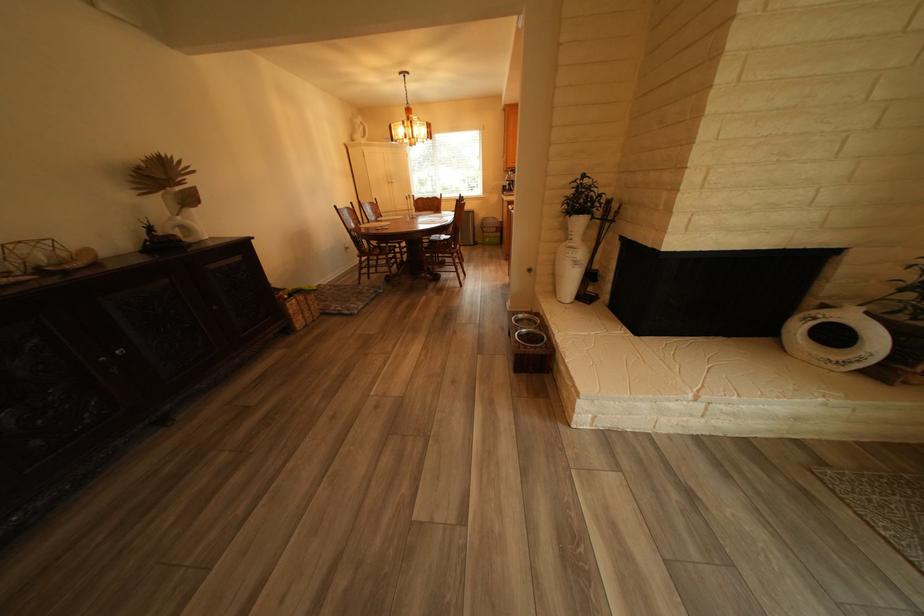
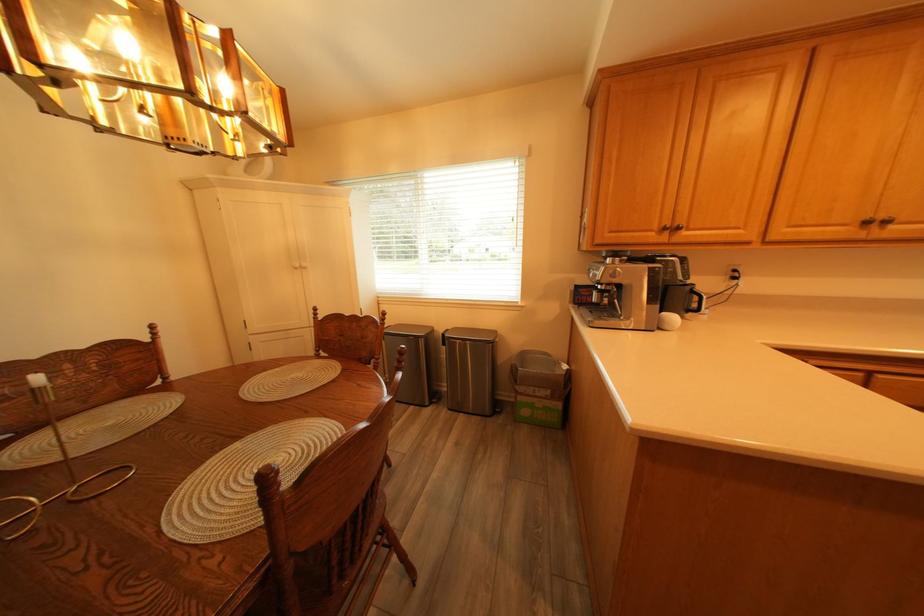
Find the pixel in the second image that matches point (511, 232) in the first image.

(566, 398)